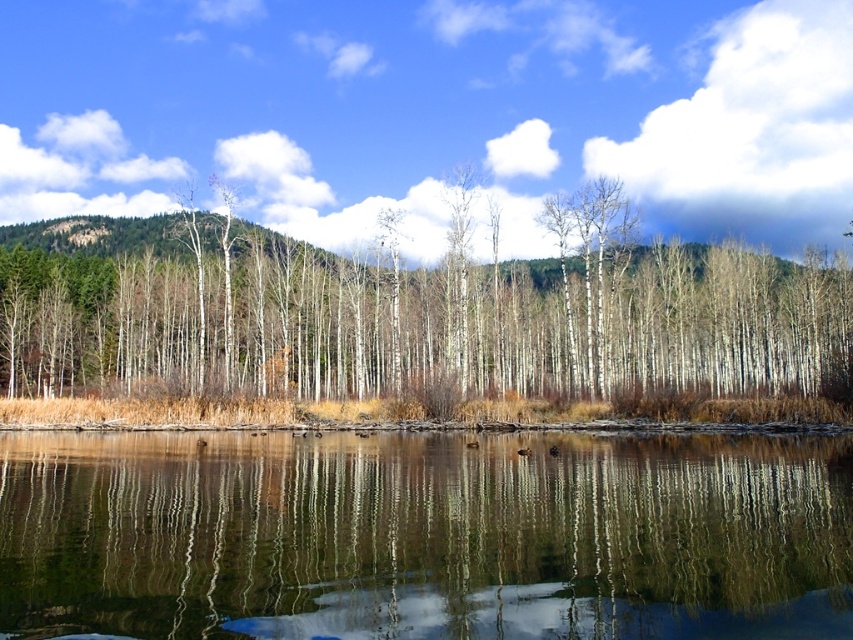
You are standing at the edge of the water in the serene landscape scene. You notice two points marked in the image. Which of the two points, point (490, 476) or point (640, 282), is closer to your current position?

Point (490, 476) is closer to the camera than point (640, 282), so the point closer to your current position is point (490, 476).

You are standing at the edge of the water and want to take a photo of both the transparent water at center and the white smooth trees at center. Which object will appear larger in your photo?

The transparent water at center will appear larger in the photo because it is closer to the viewer than the white smooth trees at center.

You are a hiker who wants to cross the transparent water at center to reach the white smooth trees at center. The path between them is 44.25 meters. If your average walking speed is 1.5 meters per second, how many seconds will it take you to reach the trees?

The distance between the transparent water at center and the white smooth trees at center is 44.25 meters. At a speed of 1.5 meters per second, it would take approximately 29.5 seconds to reach the trees.